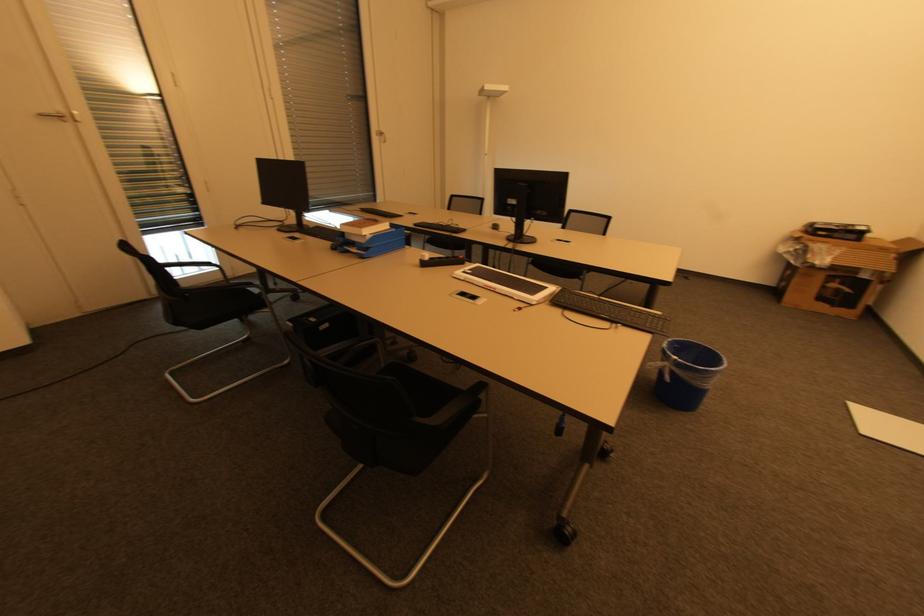
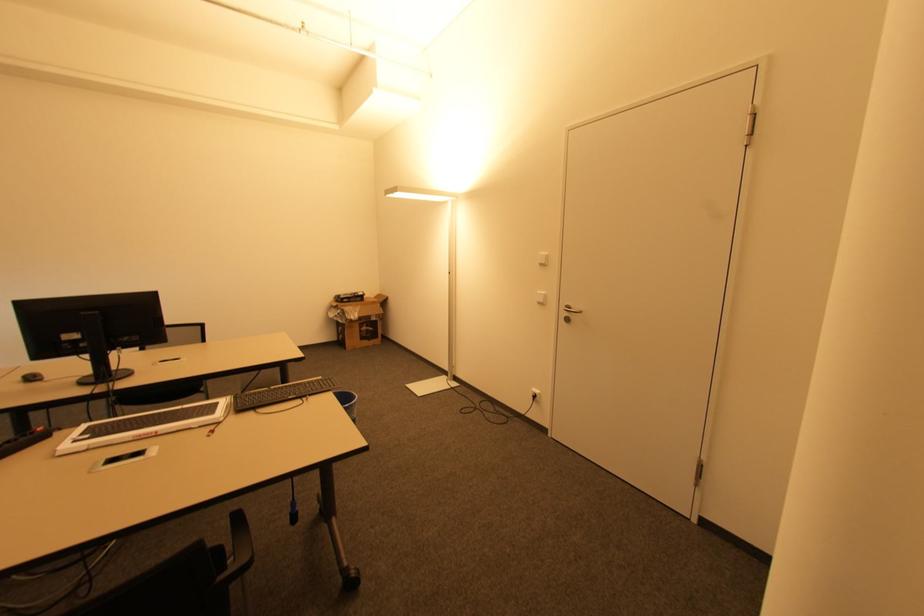
Question: The camera is either moving clockwise (left) or counter-clockwise (right) around the object. The first image is from the beginning of the video and the second image is from the end. Is the camera moving left or right when shooting the video?

Choices:
 (A) Left
 (B) Right

Answer: (A)